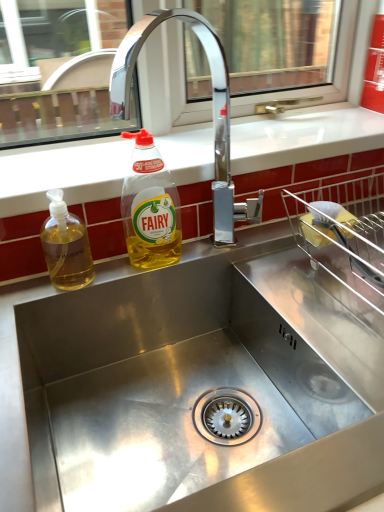
Identify the location of free point above white glossy countertop at upper center (from a real-world perspective). The height and width of the screenshot is (512, 384). (222, 141).